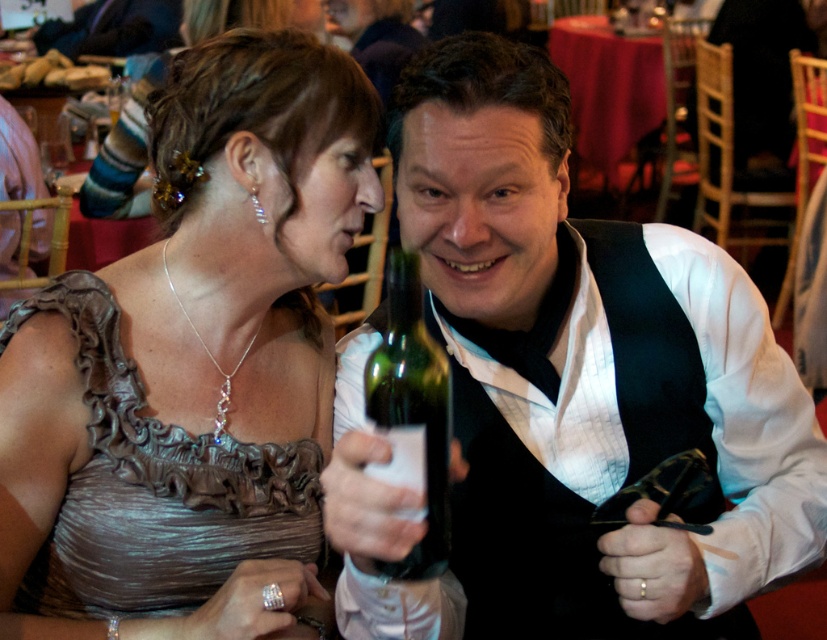
You are at the event and want to take a photo of both the point at (519, 545) and the point at (433, 472). Which point should you focus on first to ensure both are in focus?

You should focus on the point at (433, 472) first because it is farther from the viewer than the point at (519, 545). By focusing on the farther point, the closer point will also be in focus due to the depth of field.